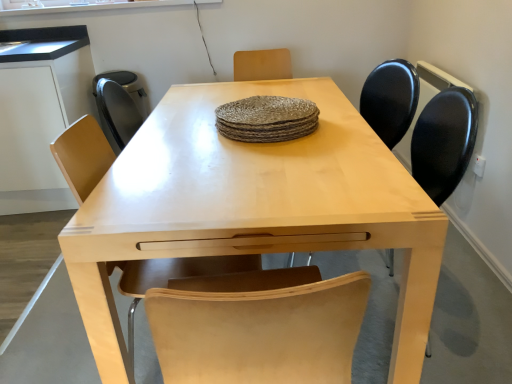
Identify the location of vacant space to the right of rustic woven placemat at center. The height and width of the screenshot is (384, 512). (345, 126).